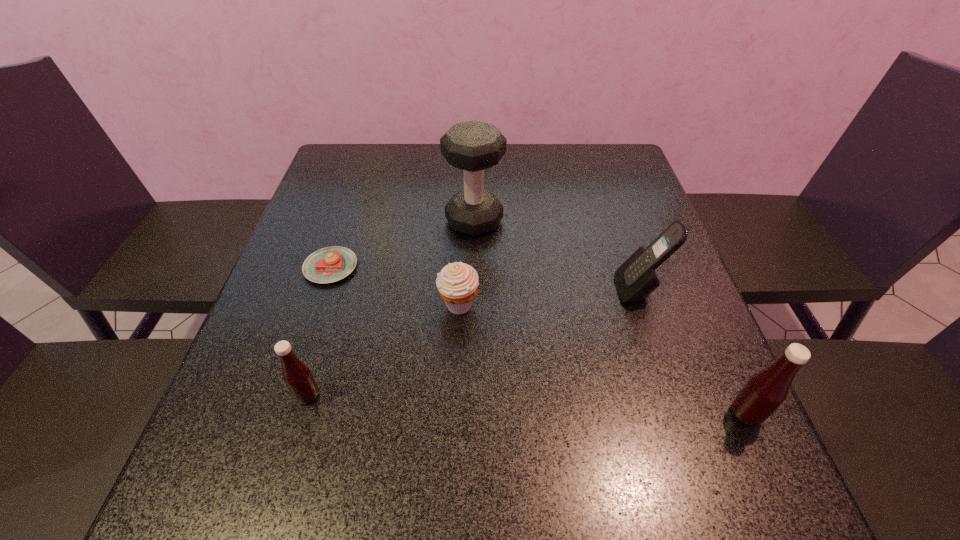
At what (x,y) coordinates should I click in order to perform the action: click on empty space that is in between the fifth tallest object and the cellular telephone. Please return your answer as a coordinate pair (x, y). The width and height of the screenshot is (960, 540). Looking at the image, I should click on (549, 297).

Image resolution: width=960 pixels, height=540 pixels. I want to click on unoccupied area between the second object from right to left and the rightmost object, so click(692, 352).

You are a GUI agent. You are given a task and a screenshot of the screen. Output one action in this format:
    pyautogui.click(x=<x>, y=<y>)
    Task: Click on the vacant space that's between the right Tabasco sauce and the muffin
    
    Given the screenshot: What is the action you would take?
    pyautogui.click(x=602, y=359)

The width and height of the screenshot is (960, 540). Identify the location of vacant area that lies between the shortest object and the rightmost object. (539, 340).

At what (x,y) coordinates should I click in order to perform the action: click on vacant region between the fifth tallest object and the cellular telephone. Please return your answer as a coordinate pair (x, y). Image resolution: width=960 pixels, height=540 pixels. Looking at the image, I should click on point(549,297).

Identify the location of vacant region between the shortest object and the rightmost object. (539, 340).

Find the location of a particular element. The height and width of the screenshot is (540, 960). vacant area that lies between the dumbbell and the rightmost object is located at coordinates (610, 318).

Where is `vacant area that lies between the fifth object from left to right and the tallest object`? The image size is (960, 540). vacant area that lies between the fifth object from left to right and the tallest object is located at coordinates (557, 255).

Find the location of a particular element. The width and height of the screenshot is (960, 540). free space between the left Tabasco sauce and the rightmost object is located at coordinates [x=527, y=404].

Identify which object is the fifth closest to the tallest object. Please provide its 2D coordinates. Your answer should be formatted as a tuple, i.e. [(x, y)], where the tuple contains the x and y coordinates of a point satisfying the conditions above.

[(766, 390)]